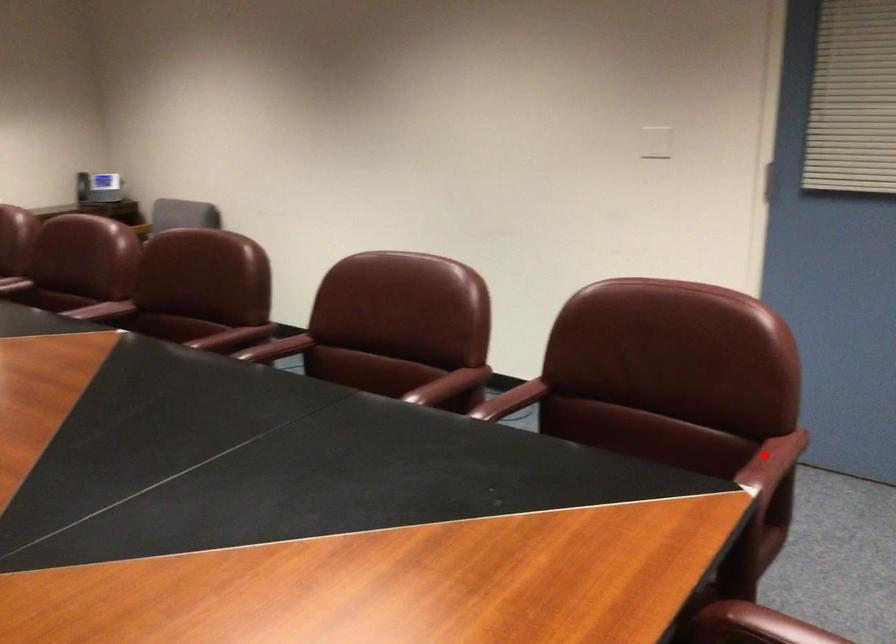
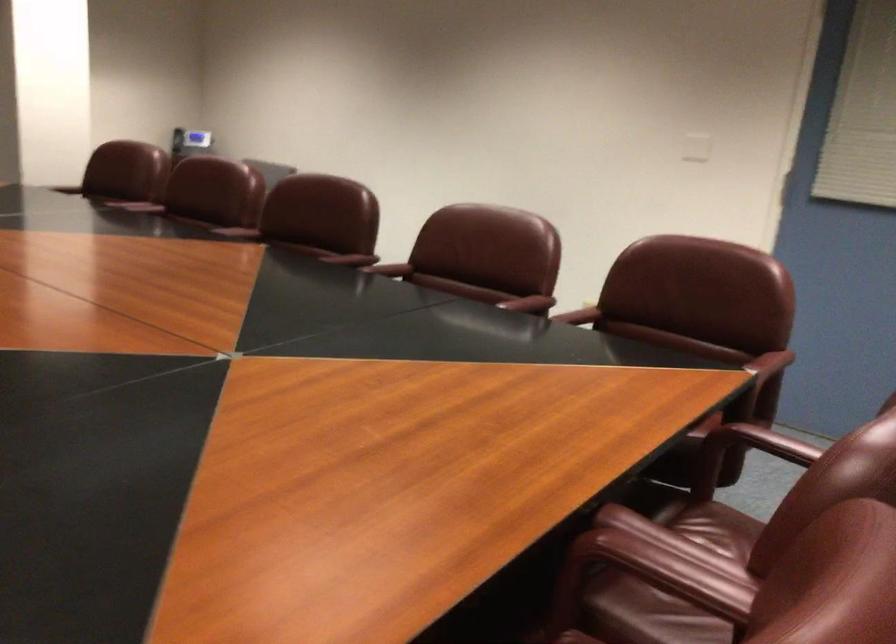
Find the pixel in the second image that matches the highlighted location in the first image.

(769, 362)